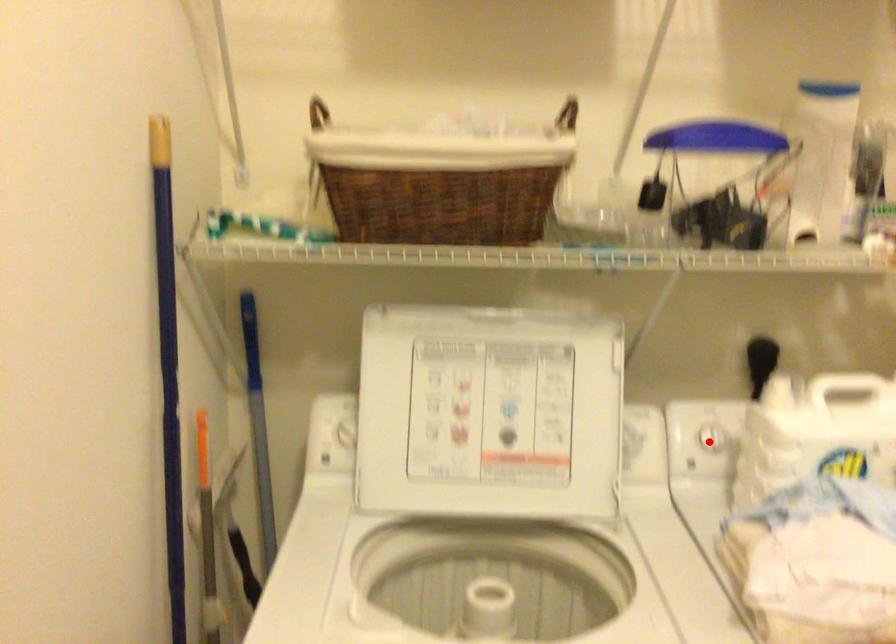
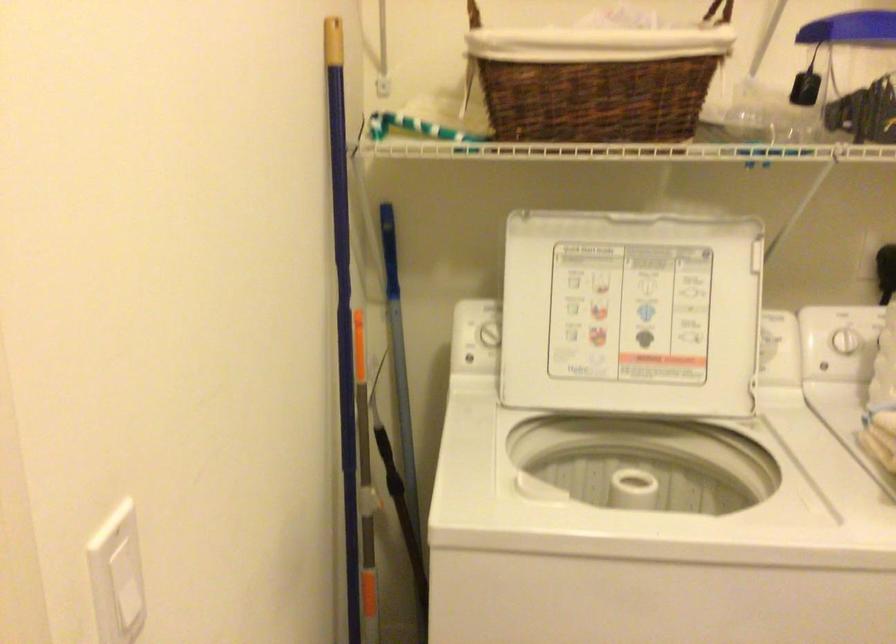
Where in the second image is the point corresponding to the highlighted location from the first image?

(845, 341)